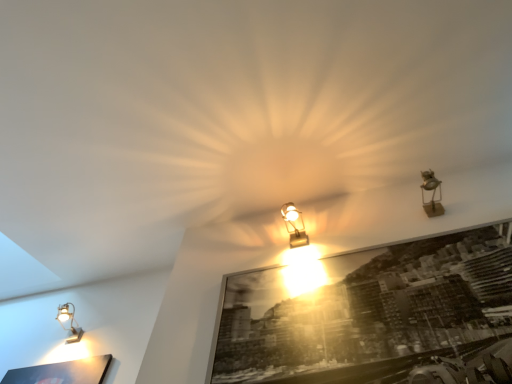
Locate an element on the screen. matte gold lamp at center, placed as the 2th lamp when sorted from back to front is located at coordinates (294, 225).

Where is `matte silver lamp at lower left, arranged as the third lamp when viewed from the right`? The height and width of the screenshot is (384, 512). matte silver lamp at lower left, arranged as the third lamp when viewed from the right is located at coordinates (69, 322).

Measure the distance between metallic gold spotlight at upper right, the third lamp ordered from the bottom, and camera.

They are 1.93 meters apart.

The width and height of the screenshot is (512, 384). I want to click on black glossy picture frame at center, so click(x=372, y=314).

Where is `picture frame located in front of the matte silver lamp at lower left, arranged as the third lamp when viewed from the right`? This screenshot has height=384, width=512. picture frame located in front of the matte silver lamp at lower left, arranged as the third lamp when viewed from the right is located at coordinates (372, 314).

Is point (68, 304) in front of point (330, 265)?

No, it is not.

Could you measure the distance between matte silver lamp at lower left, the third lamp in the front-to-back sequence, and black glossy picture frame at center?

matte silver lamp at lower left, the third lamp in the front-to-back sequence, is 1.61 meters away from black glossy picture frame at center.

Is matte silver lamp at lower left, which is counted as the 3th lamp, starting from the top, oriented away from black glossy picture frame at center?

No.

Between point (483, 266) and point (290, 231), which one is positioned behind?

The point (290, 231) is more distant.

From the picture: From the image's perspective, is black glossy picture frame at center under matte gold lamp at center, the second lamp ordered from the bottom?

Yes.

In the scene shown: From a real-world perspective, is black glossy picture frame at center physically above matte gold lamp at center, the second lamp viewed from the top?

No.

Looking at this image, from the image's perspective, is matte gold lamp at center, the second lamp viewed from the top, below matte silver lamp at lower left, the third lamp in the front-to-back sequence?

Incorrect, from the image's perspective, matte gold lamp at center, the second lamp viewed from the top, is higher than matte silver lamp at lower left, the third lamp in the front-to-back sequence.

I want to click on lamp that is behind the matte gold lamp at center, placed as the 2th lamp when sorted from back to front, so tap(69, 322).

Is matte gold lamp at center, the second lamp in the right-to-left sequence, directly adjacent to matte silver lamp at lower left, arranged as the 1th lamp when viewed from the back?

There is a gap between matte gold lamp at center, the second lamp in the right-to-left sequence, and matte silver lamp at lower left, arranged as the 1th lamp when viewed from the back.

Is matte silver lamp at lower left, the third lamp in the front-to-back sequence, placed right next to matte gold lamp at center, the second lamp viewed from the top?

matte silver lamp at lower left, the third lamp in the front-to-back sequence, and matte gold lamp at center, the second lamp viewed from the top, are clearly separated.

From a real-world perspective, who is located lower, matte silver lamp at lower left, which is counted as the 3th lamp, starting from the top, or matte gold lamp at center, the second lamp in the right-to-left sequence?

In real-world perspective, matte gold lamp at center, the second lamp in the right-to-left sequence, is lower.

Is matte silver lamp at lower left, arranged as the third lamp when viewed from the right, positioned with its back to matte gold lamp at center, placed as the second lamp when sorted from front to back?

No, matte silver lamp at lower left, arranged as the third lamp when viewed from the right, is not facing away from matte gold lamp at center, placed as the second lamp when sorted from front to back.

Can you see matte gold lamp at center, the second lamp in the right-to-left sequence, touching metallic gold spotlight at upper right, the third lamp ordered from the bottom?

matte gold lamp at center, the second lamp in the right-to-left sequence, and metallic gold spotlight at upper right, the third lamp ordered from the bottom, are clearly separated.

From the image's perspective, is matte gold lamp at center, the second lamp viewed from the top, beneath metallic gold spotlight at upper right, the first lamp when ordered from right to left?

Correct, matte gold lamp at center, the second lamp viewed from the top, appears lower than metallic gold spotlight at upper right, the first lamp when ordered from right to left, in the image.

From a real-world perspective, which object stands above the other?

In real-world perspective, metallic gold spotlight at upper right, the 1th lamp from the top, is above.

Could you tell me if matte gold lamp at center, the second lamp in the right-to-left sequence, is turned towards metallic gold spotlight at upper right, the 1th lamp from the top?

No.

Is black glossy picture frame at center oriented towards matte silver lamp at lower left, arranged as the third lamp when viewed from the right?

No, black glossy picture frame at center is not facing towards matte silver lamp at lower left, arranged as the third lamp when viewed from the right.

Are black glossy picture frame at center and matte silver lamp at lower left, which is counted as the 3th lamp, starting from the top, making contact?

No, black glossy picture frame at center is not making contact with matte silver lamp at lower left, which is counted as the 3th lamp, starting from the top.

Can you confirm if black glossy picture frame at center is thinner than matte silver lamp at lower left, arranged as the 1th lamp when viewed from the back?

Correct, the width of black glossy picture frame at center is less than that of matte silver lamp at lower left, arranged as the 1th lamp when viewed from the back.

Are metallic gold spotlight at upper right, marked as the third lamp in a left-to-right arrangement, and black glossy picture frame at center beside each other?

They are not placed beside each other.

Is metallic gold spotlight at upper right, the first lamp when ordered from right to left, positioned with its back to black glossy picture frame at center?

No, metallic gold spotlight at upper right, the first lamp when ordered from right to left, is not facing the opposite direction of black glossy picture frame at center.

From the image's perspective, which is above, metallic gold spotlight at upper right, the third lamp ordered from the bottom, or black glossy picture frame at center?

metallic gold spotlight at upper right, the third lamp ordered from the bottom.

The image size is (512, 384). I want to click on lamp that is the 1st object located behind the black glossy picture frame at center, so click(432, 194).

This screenshot has width=512, height=384. In order to click on lamp that is the 3rd one above the black glossy picture frame at center (from a real-world perspective) in this screenshot , I will do `click(69, 322)`.

From the black glossy picture frame at center, count 2nd lamps backward and point to it. Please provide its 2D coordinates.

[(294, 225)]

From the image, which object appears to be farther from black glossy picture frame at center, metallic gold spotlight at upper right, the 1th lamp when ordered from front to back, or matte silver lamp at lower left, arranged as the 1th lamp when viewed from the back?

The object further to black glossy picture frame at center is matte silver lamp at lower left, arranged as the 1th lamp when viewed from the back.

Looking at the image, which one is located further to black glossy picture frame at center, matte gold lamp at center, the second lamp viewed from the top, or matte silver lamp at lower left, which is counted as the 3th lamp, starting from the top?

matte silver lamp at lower left, which is counted as the 3th lamp, starting from the top.

Looking at the image, which one is located further to black glossy picture frame at center, matte silver lamp at lower left, arranged as the 1th lamp when viewed from the back, or metallic gold spotlight at upper right, marked as the third lamp in a left-to-right arrangement?

matte silver lamp at lower left, arranged as the 1th lamp when viewed from the back, is positioned further to the anchor black glossy picture frame at center.

From the image, which object appears to be farther from metallic gold spotlight at upper right, the 1th lamp when ordered from front to back, matte silver lamp at lower left, arranged as the 1th lamp when viewed from the back, or matte gold lamp at center, the 2th lamp in the left-to-right sequence?

matte silver lamp at lower left, arranged as the 1th lamp when viewed from the back.

Estimate the real-world distances between objects in this image. Which object is further from matte gold lamp at center, the 2th lamp in the left-to-right sequence, black glossy picture frame at center or metallic gold spotlight at upper right, the third lamp ordered from the bottom?

metallic gold spotlight at upper right, the third lamp ordered from the bottom, is further to matte gold lamp at center, the 2th lamp in the left-to-right sequence.

From the image, which object appears to be farther from matte gold lamp at center, the second lamp viewed from the top, black glossy picture frame at center or matte silver lamp at lower left, which is counted as the 3th lamp, starting from the top?

Based on the image, matte silver lamp at lower left, which is counted as the 3th lamp, starting from the top, appears to be further to matte gold lamp at center, the second lamp viewed from the top.

Estimate the real-world distances between objects in this image. Which object is further from black glossy picture frame at center, metallic gold spotlight at upper right, the 1th lamp from the top, or matte gold lamp at center, the second lamp ordered from the bottom?

Based on the image, metallic gold spotlight at upper right, the 1th lamp from the top, appears to be further to black glossy picture frame at center.

Which object lies further to the anchor point matte silver lamp at lower left, arranged as the third lamp when viewed from the right, metallic gold spotlight at upper right, the 3th lamp positioned from the back, or matte gold lamp at center, the second lamp in the right-to-left sequence?

metallic gold spotlight at upper right, the 3th lamp positioned from the back, is positioned further to the anchor matte silver lamp at lower left, arranged as the third lamp when viewed from the right.

Identify the location of lamp located between matte silver lamp at lower left, which is counted as the 3th lamp, starting from the top, and black glossy picture frame at center in the left-right direction. (294, 225).

Find the location of a particular element. The width and height of the screenshot is (512, 384). lamp located between black glossy picture frame at center and matte gold lamp at center, the 2th lamp in the left-to-right sequence, in the depth direction is located at coordinates (432, 194).

Image resolution: width=512 pixels, height=384 pixels. Identify the location of picture frame between matte silver lamp at lower left, which is counted as the 3th lamp, starting from the top, and metallic gold spotlight at upper right, marked as the third lamp in a left-to-right arrangement, in the horizontal direction. (372, 314).

Locate an element on the screen. Image resolution: width=512 pixels, height=384 pixels. lamp between matte silver lamp at lower left, which is counted as the 3th lamp, starting from the top, and metallic gold spotlight at upper right, the 1th lamp when ordered from front to back is located at coordinates (294, 225).